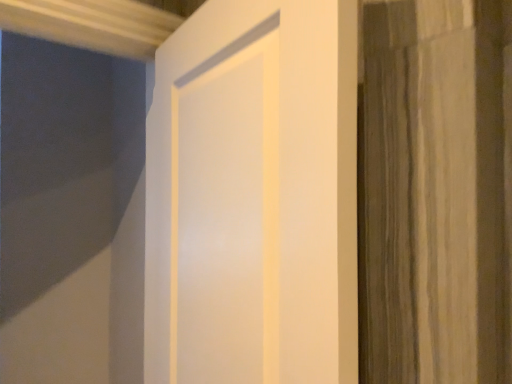
Measure the distance between white glossy door at center and camera.

white glossy door at center is 20.25 inches from camera.

The image size is (512, 384). Describe the element at coordinates (254, 196) in the screenshot. I see `white glossy door at center` at that location.

The width and height of the screenshot is (512, 384). Identify the location of white glossy door at center. (254, 196).

Image resolution: width=512 pixels, height=384 pixels. I want to click on white glossy door at center, so click(254, 196).